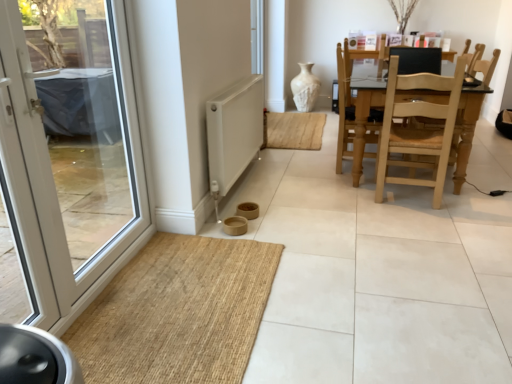
Identify the location of free space in front of light brown wooden swivel chair at center. The image size is (512, 384). (346, 185).